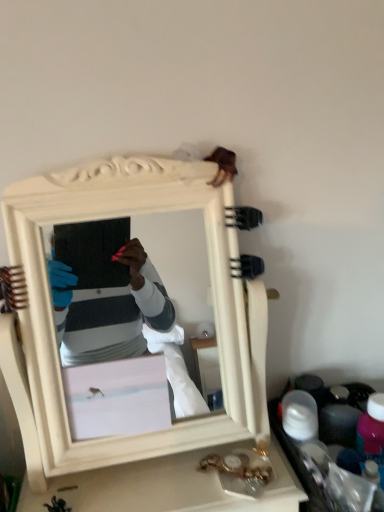
Describe the element at coordinates (122, 313) in the screenshot. I see `white wood cabinet at center` at that location.

Locate an element on the screen. The height and width of the screenshot is (512, 384). white wood cabinet at center is located at coordinates (122, 313).

Find the location of a particular element. This screenshot has width=384, height=512. white wood cabinet at center is located at coordinates (122, 313).